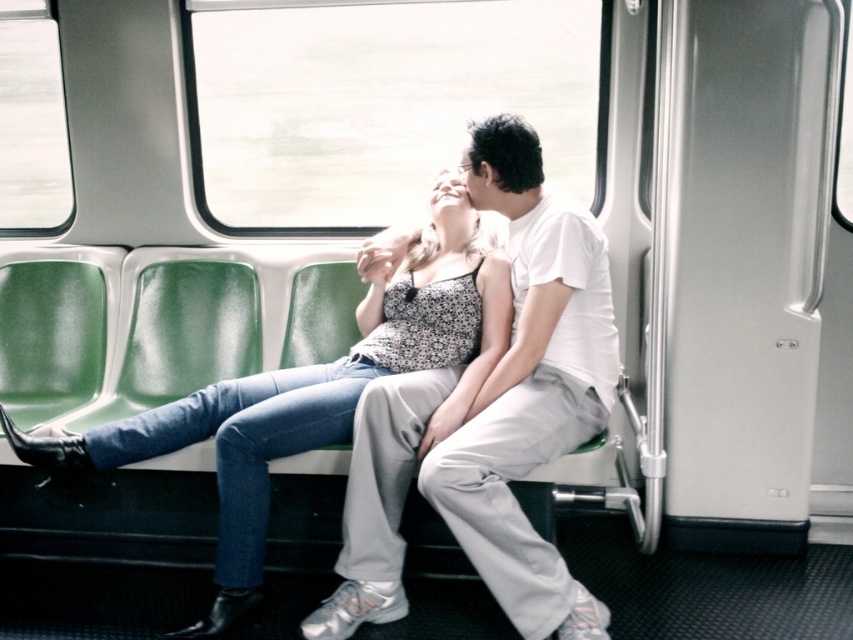
Question: Can you confirm if white cotton shirt at center is smaller than denim jeans at center?

Choices:
 (A) yes
 (B) no

Answer: (A)

Question: Does white cotton shirt at center appear under denim jeans at center?

Choices:
 (A) yes
 (B) no

Answer: (B)

Question: Which point is farther to the camera?

Choices:
 (A) denim jeans at center
 (B) white cotton shirt at center

Answer: (A)

Question: Is white cotton shirt at center to the right of denim jeans at center from the viewer's perspective?

Choices:
 (A) no
 (B) yes

Answer: (B)

Question: Which object appears farthest from the camera in this image?

Choices:
 (A) denim jeans at center
 (B) white cotton shirt at center

Answer: (A)